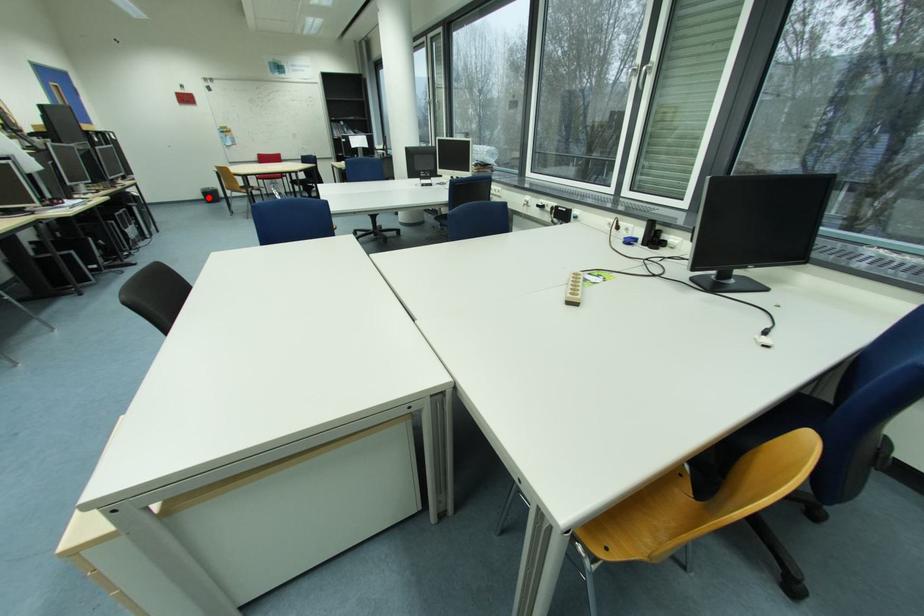
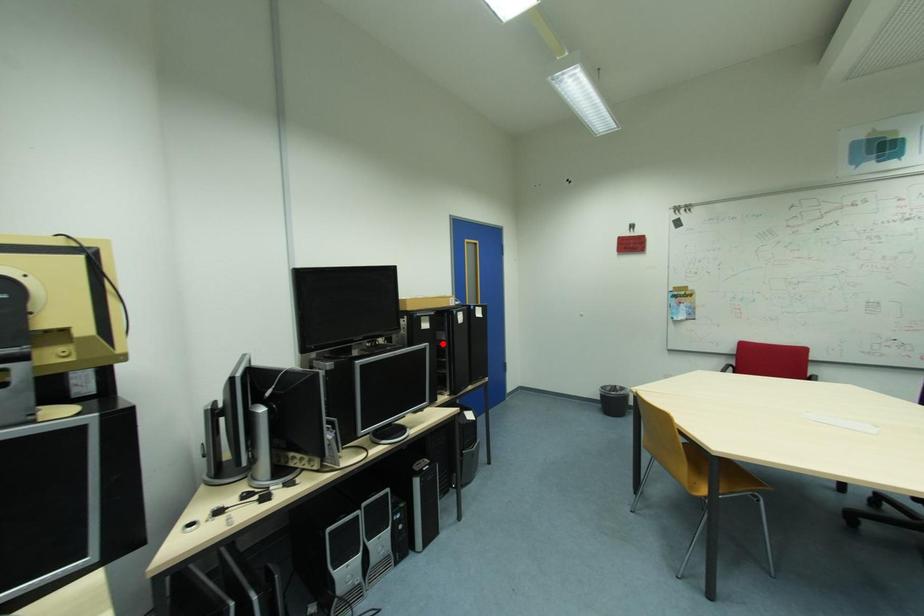
I am providing you with two images of the same scene from different viewpoints. A red point is marked on the first image and another point is marked on the second image. Are the points marked in image1 and image2 representing the same 3D position?

No